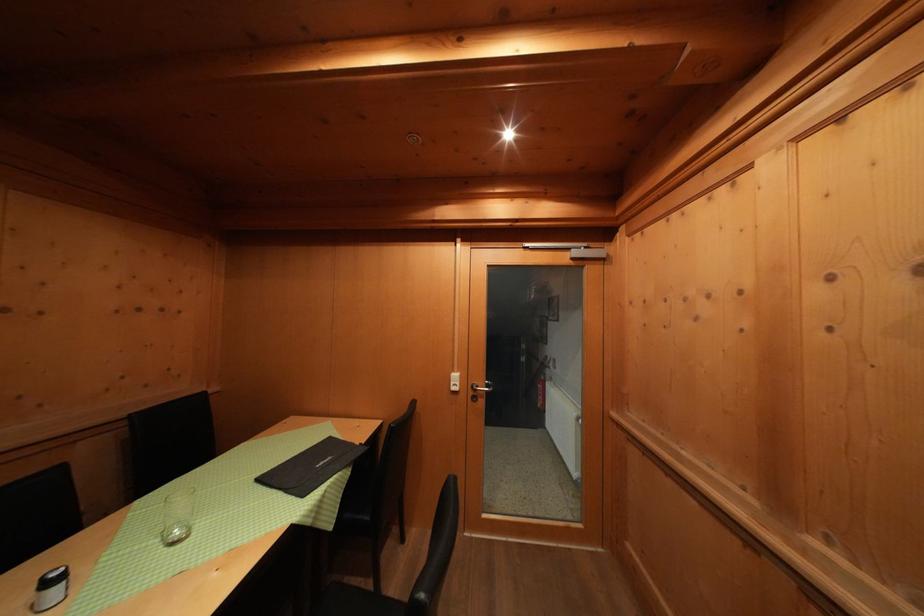
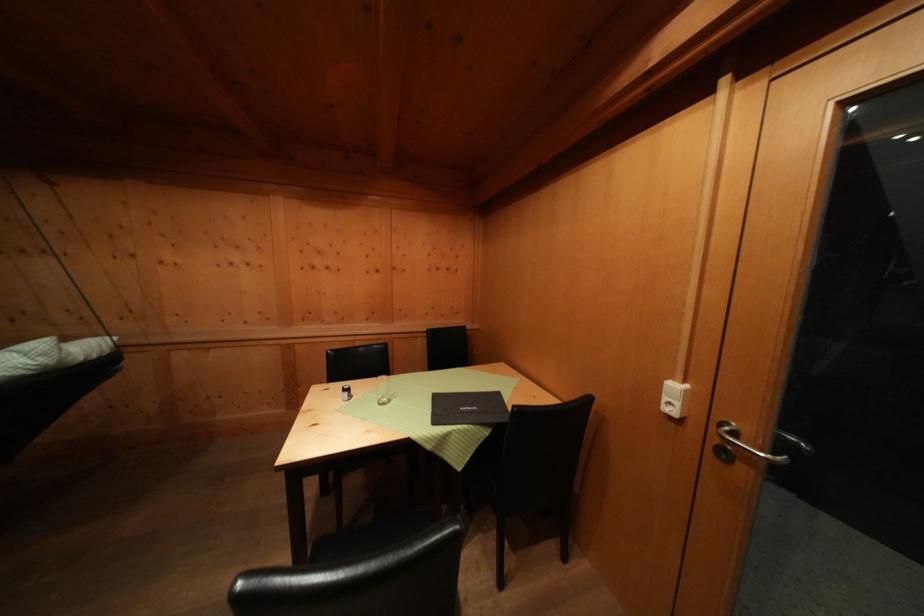
In the second image, find the point that corresponds to (x=458, y=389) in the first image.

(672, 403)